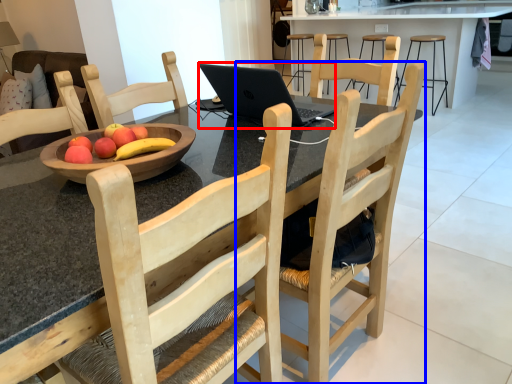
Question: Which point is further to the camera, laptop (highlighted by a red box) or chair (highlighted by a blue box)?

Choices:
 (A) laptop
 (B) chair

Answer: (A)